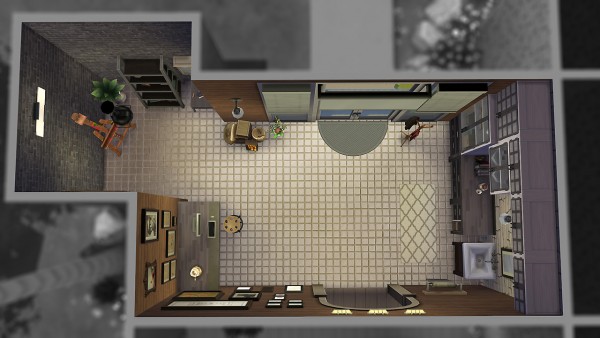
At what (x,y) coordinates should I click in order to perform the action: click on pictures. Please return your answer as a coordinate pair (x, y). This screenshot has width=600, height=338. Looking at the image, I should click on (157, 238).